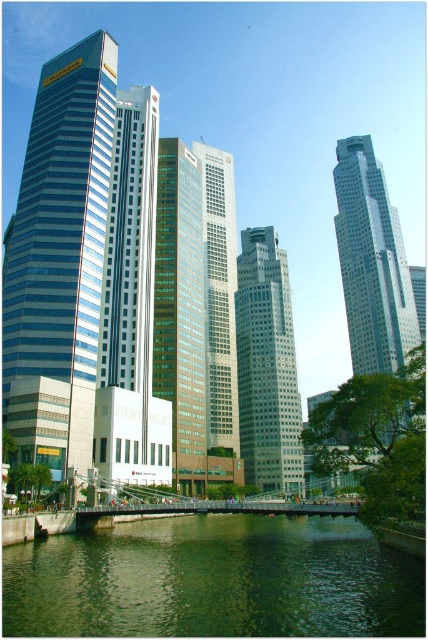
Question: Among these objects, which one is nearest to the camera?

Choices:
 (A) green glass skyscraper at center
 (B) gray glass skyscraper at center
 (C) green liquid water at lower center
 (D) shiny glass skyscraper at left

Answer: (C)

Question: Which point is closer to the camera?

Choices:
 (A) (207, 323)
 (B) (98, 163)
 (C) (26, 564)

Answer: (C)

Question: Is glassy steel skyscraper at center further to camera compared to glassy silver skyscraper at center?

Choices:
 (A) yes
 (B) no

Answer: (B)

Question: Among these objects, which one is farthest from the camera?

Choices:
 (A) shiny glass skyscraper at left
 (B) green liquid water at lower center
 (C) gray glass skyscraper at center
 (D) glassy silver skyscraper at center

Answer: (C)

Question: Can you confirm if glassy white skyscraper at center is bigger than glassy silver skyscraper at center?

Choices:
 (A) yes
 (B) no

Answer: (A)

Question: Does glassy steel skyscraper at center appear on the right side of gray glass skyscraper at center?

Choices:
 (A) no
 (B) yes

Answer: (A)